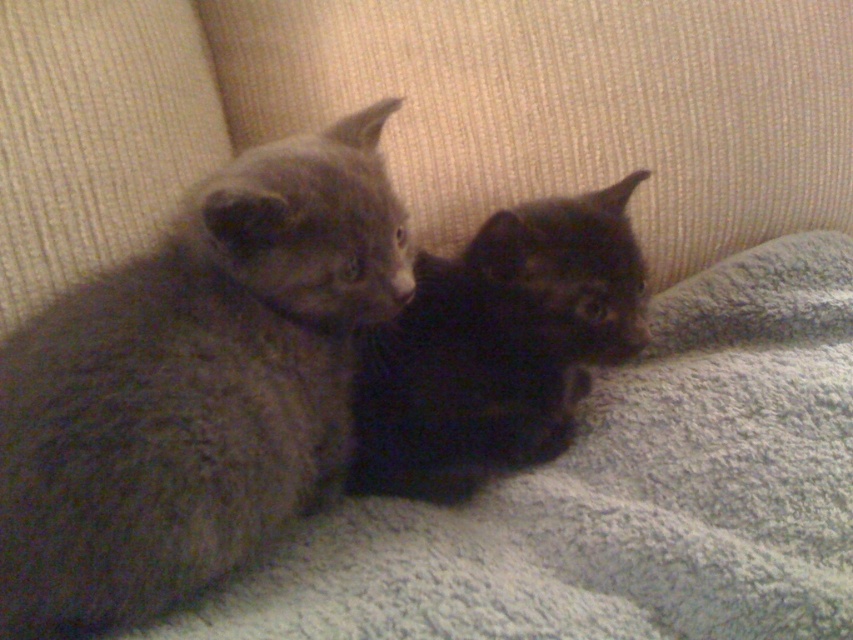
You are standing at a distance and want to reach the point marked at coordinates (154, 321) in the image. If you can stretch your arm 30 inches forward, will you be able to touch that point?

The point marked at coordinates (154, 321) is 31.97 inches away from you. Since your arm can only stretch 30 inches, you won t be able to touch it.

You are a cat owner who wants to place a small toy between the soft gray fur kitten at left and the black fuzzy cat at center. Based on their positions, where should you place the toy so it is equidistant from both?

The soft gray fur kitten at left is in front of the black fuzzy cat at center, so placing the toy directly between them along the line connecting their positions would ensure it is equidistant from both.